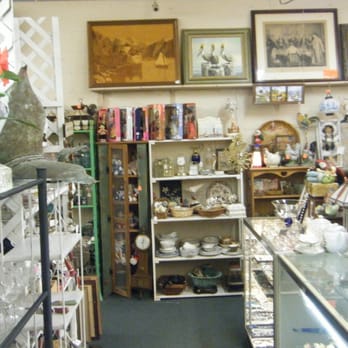
Identify the location of dishware. (197, 248), (187, 248), (222, 247), (333, 239), (7, 285).